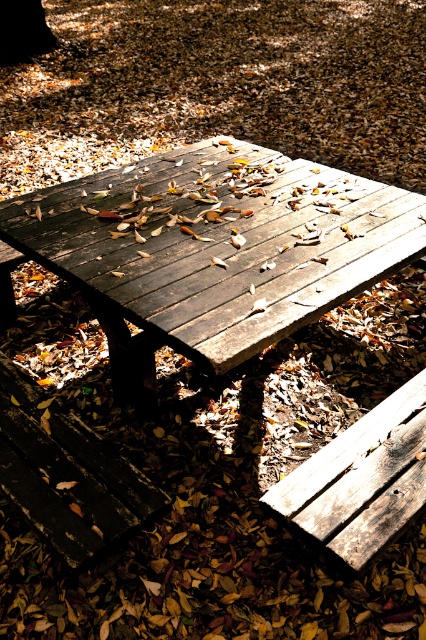
Question: Does dark brown wood picnic table at center appear under smooth dark brown tree trunk at upper left?

Choices:
 (A) no
 (B) yes

Answer: (B)

Question: Which of the following is the closest to the observer?

Choices:
 (A) wooden bench at lower right
 (B) dark brown wood picnic table at center
 (C) smooth dark brown tree trunk at upper left
 (D) dark brown wood bench at lower left

Answer: (A)

Question: Can you confirm if dark brown wood bench at lower left is wider than smooth dark brown tree trunk at upper left?

Choices:
 (A) no
 (B) yes

Answer: (B)

Question: Which of the following is the closest to the observer?

Choices:
 (A) dark brown wood picnic table at center
 (B) dark brown wood bench at lower left

Answer: (B)

Question: Which of these objects is positioned farthest from the dark brown wood picnic table at center?

Choices:
 (A) wooden bench at lower right
 (B) smooth dark brown tree trunk at upper left
 (C) dark brown wood bench at lower left

Answer: (B)

Question: Observing the image, what is the correct spatial positioning of dark brown wood bench at lower left in reference to wooden bench at lower right?

Choices:
 (A) above
 (B) below

Answer: (A)